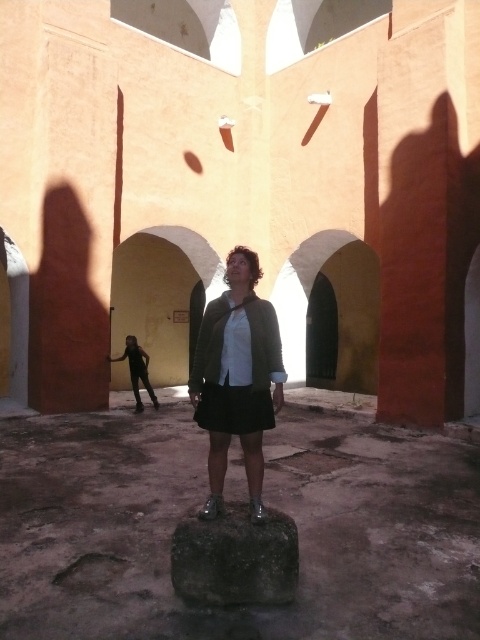
You are standing in the courtyard and see the smooth stone at center and the matte black skirt at center. Which object is positioned lower in the scene?

The smooth stone at center is located below the matte black skirt at center, so it is positioned lower in the scene.

You are standing in the courtyard and want to place a small potted plant between the smooth stone at center and the dark gray stone at center. Which stone should you place it closer to if you want the plant to receive more direct sunlight from the open windows?

The smooth stone at center is closer to the viewer, so placing the plant closer to it would position it farther away from the open windows. To receive more direct sunlight, the plant should be placed closer to the dark gray stone at center, which is farther from the viewer and likely closer to the light source from the open windows.

You are standing in the courtyard and want to place a small potted plant exactly at the center of the smooth stone at center. Based on the coordinates provided, can you confirm if the potted plant will fit perfectly at that location?

The smooth stone at center is located at coordinates point (265, 502), so placing the potted plant exactly at that point should fit perfectly as the coordinates indicate the exact center location.